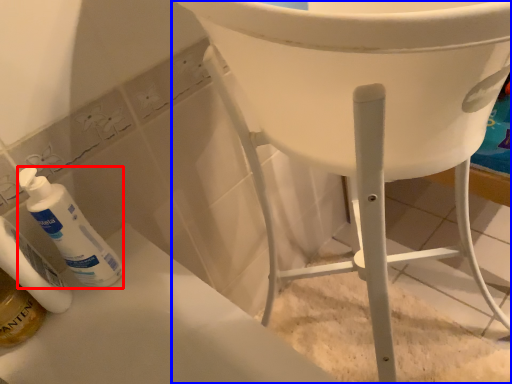
Question: Which object is further to the camera taking this photo, cleaning product (highlighted by a red box) or furniture (highlighted by a blue box)?

Choices:
 (A) cleaning product
 (B) furniture

Answer: (B)